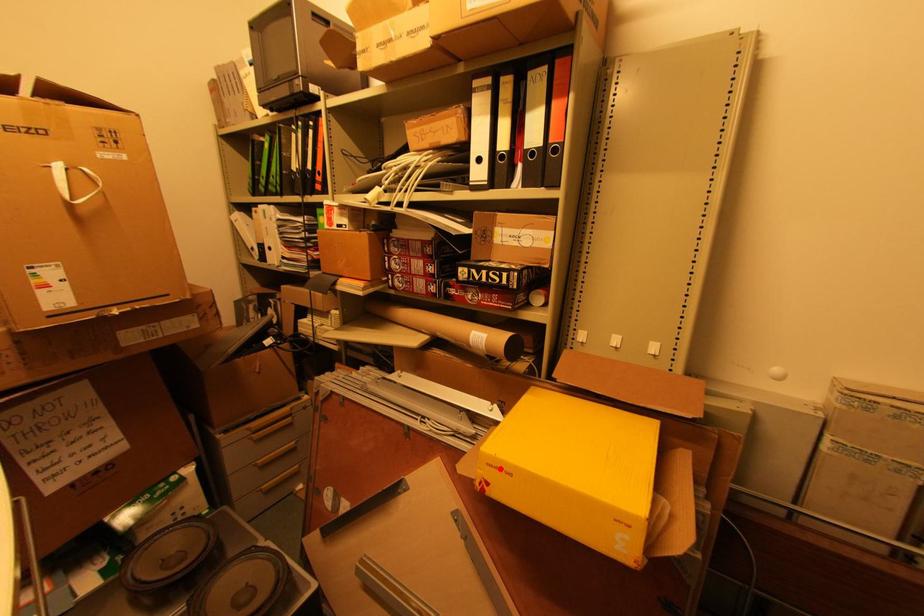
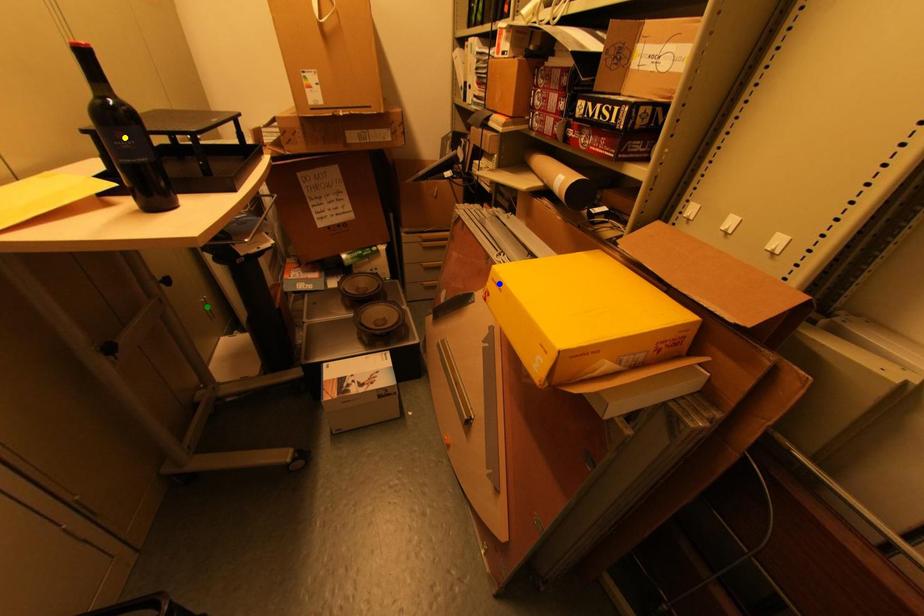
Question: I am providing you with two images of the same scene from different viewpoints. A red point is marked on the first image. You are given multiple points on the second image. Which mark in image 2 goes with the point in image 1?

Choices:
 (A) green point
 (B) blue point
 (C) yellow point

Answer: (B)